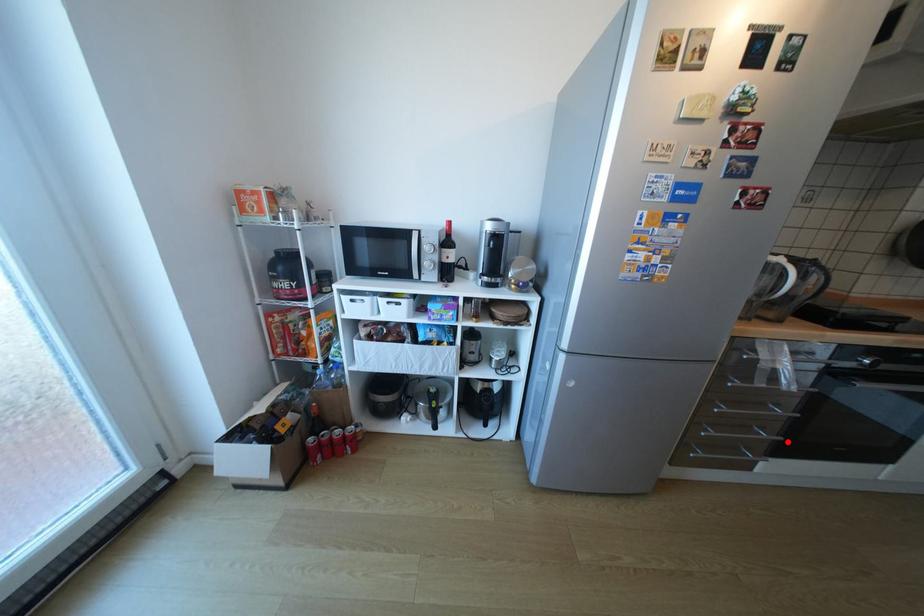
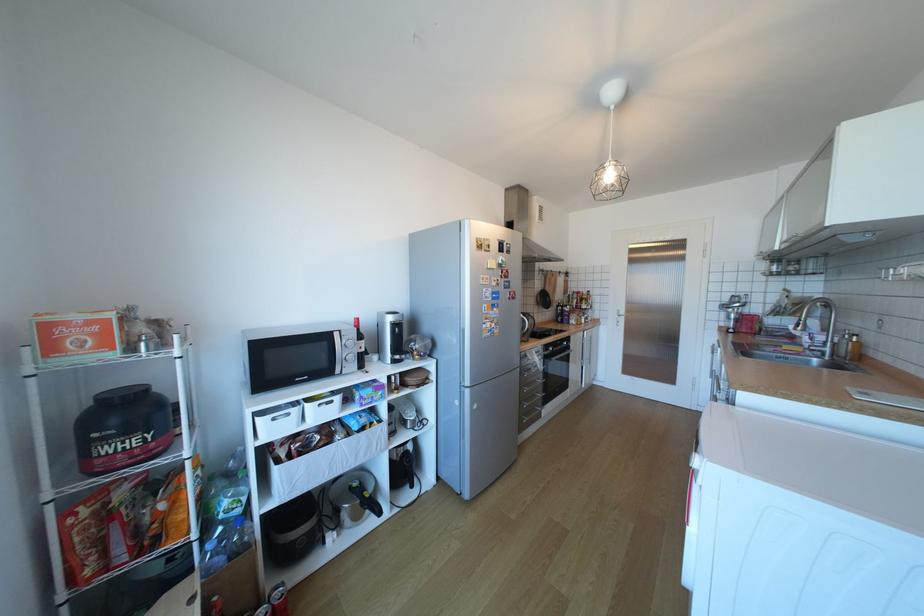
Question: A red point is marked in image1. In image2, is the corresponding 3D point closer to the camera or farther? Reply with the corresponding letter.

Choices:
 (A) The corresponding 3D point is closer.
 (B) The corresponding 3D point is farther.

Answer: (B)